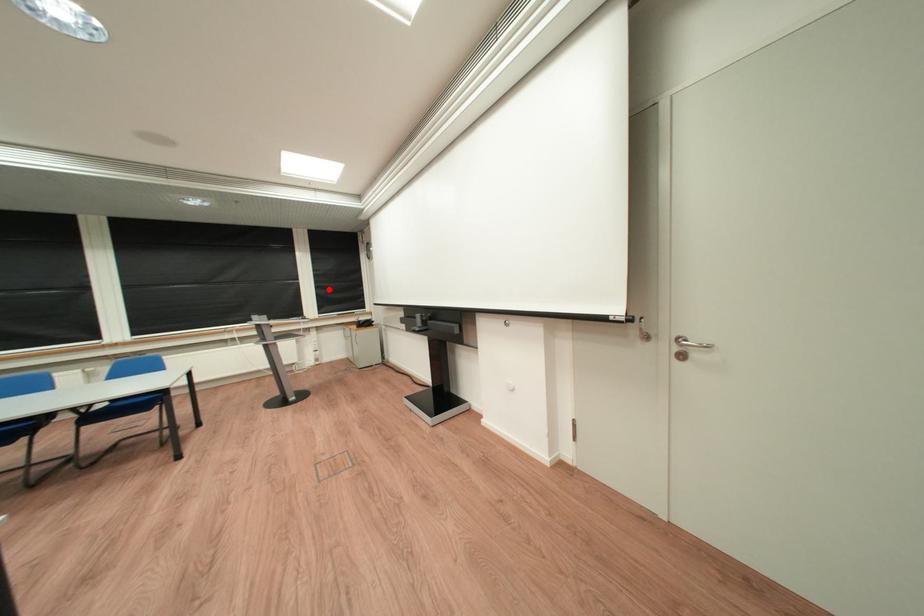
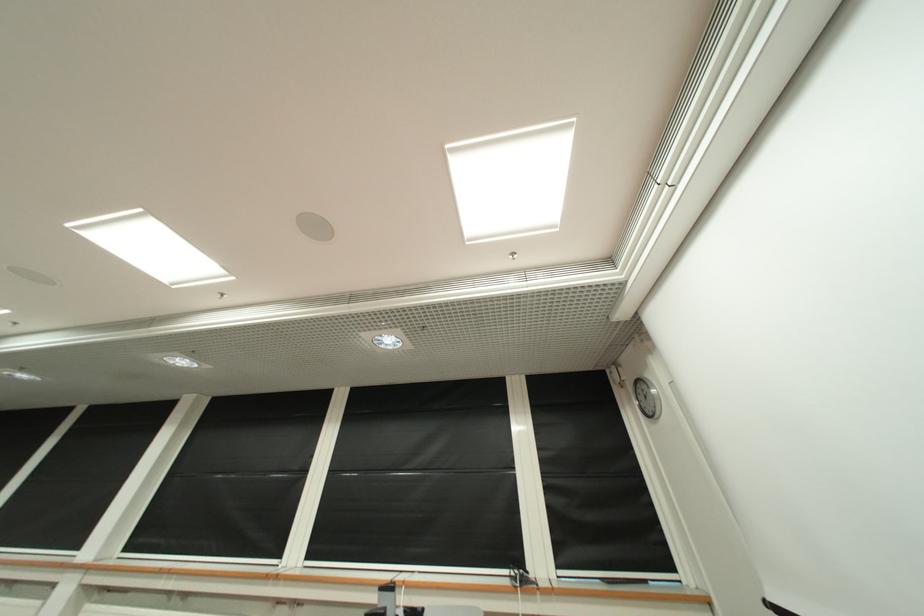
The point at the highlighted location is marked in the first image. Where is the corresponding point in the second image?

(558, 491)